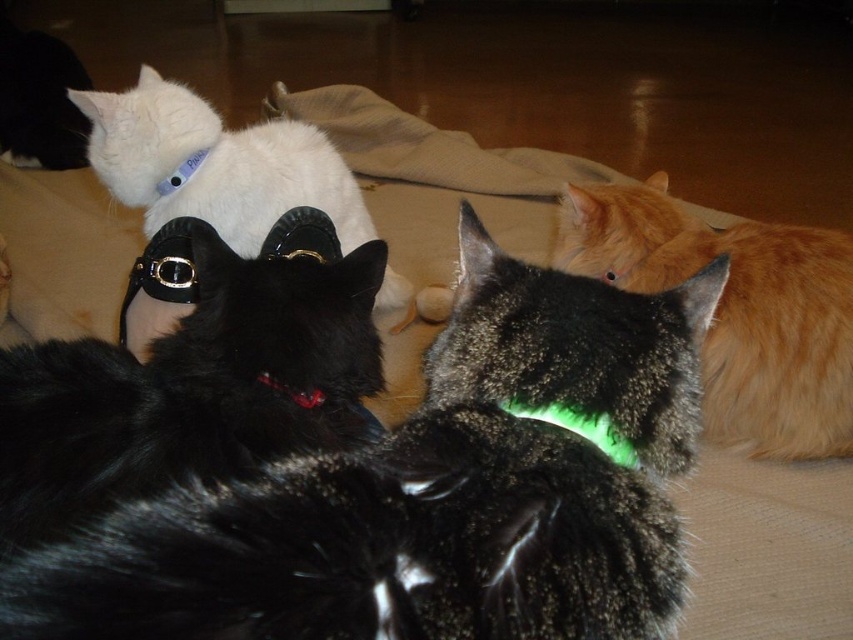
You are a cat owner trying to locate two specific spots on the blanket where your cats are resting. The first spot is at point (650, 244) and the second is at point (305, 182). Which of these two points is closer to you as you look at the image?

Point (650, 244) is in front of point (305, 182), so it is closer to you.

You are a cat owner who wants to place a new toy between the black glossy shoe at upper left and the orange fur cat at right. Based on their positions, which direction should you move the toy to ensure it stays between them?

The black glossy shoe at upper left is in front of orange fur cat at right, so to keep the toy between them, you should place it closer to the orange fur cat at right.